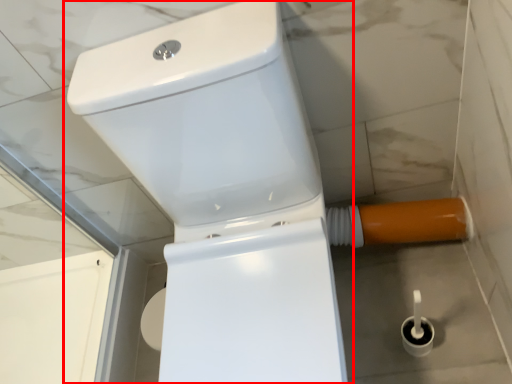
Question: From the image's perspective, where is toilet (annotated by the red box) located relative to water pipe?

Choices:
 (A) below
 (B) above

Answer: (A)